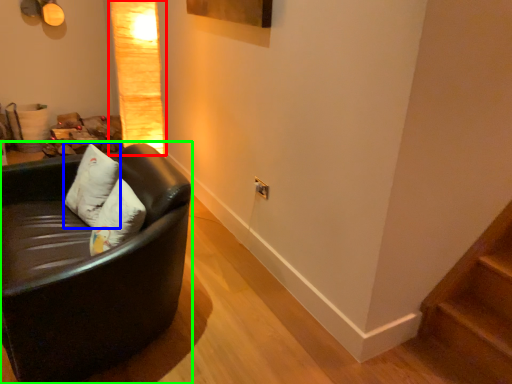
Question: Based on their relative distances, which object is nearer to lamp (highlighted by a red box)? Choose from pillow (highlighted by a blue box) and studio couch (highlighted by a green box).

Choices:
 (A) pillow
 (B) studio couch

Answer: (A)